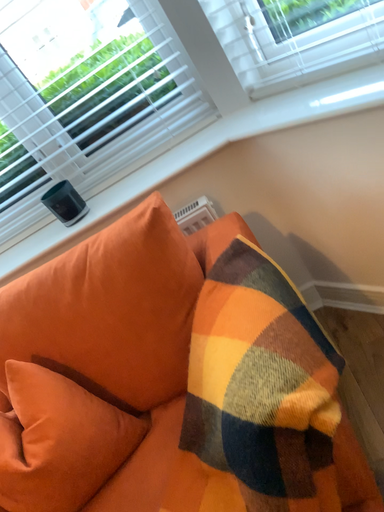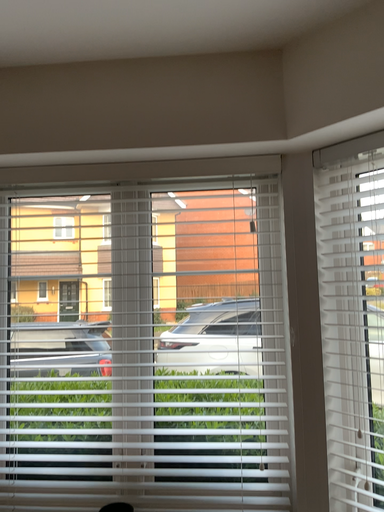
Question: Which way did the camera rotate in the video?

Choices:
 (A) rotated upward
 (B) rotated downward

Answer: (A)